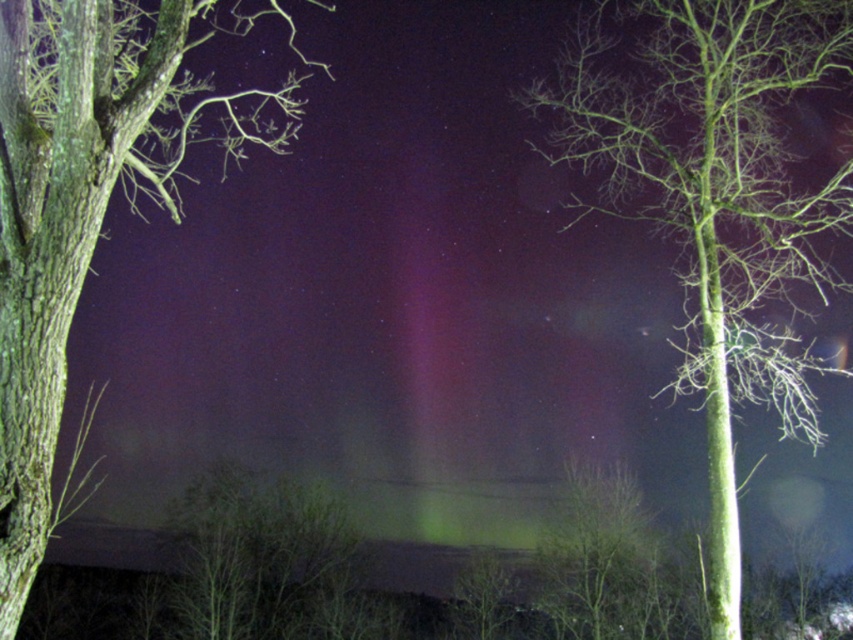
You are an astronomer observing the aurora borealis and notice the green matte tree at center and the smooth bark tree at left in the foreground. Which tree is positioned lower in the image?

The green matte tree at center is located below the smooth bark tree at left, so it is positioned lower in the image.